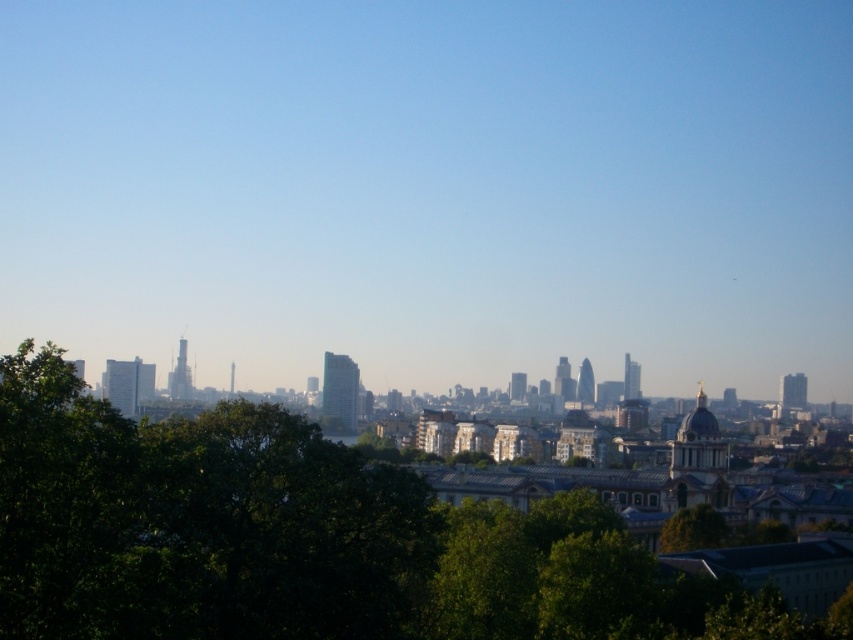
Question: Which point is closer to the camera?

Choices:
 (A) green leafy tree at lower left
 (B) green leafy tree at center

Answer: (A)

Question: Does green leafy tree at lower left have a smaller size compared to green leafy tree at center?

Choices:
 (A) yes
 (B) no

Answer: (B)

Question: Which object is closer to the camera taking this photo?

Choices:
 (A) green leafy tree at lower left
 (B) green leafy tree at center

Answer: (A)

Question: Does green leafy tree at lower left have a larger size compared to green leafy tree at center?

Choices:
 (A) yes
 (B) no

Answer: (A)

Question: Can you confirm if green leafy tree at lower left is positioned above green leafy tree at center?

Choices:
 (A) yes
 (B) no

Answer: (B)